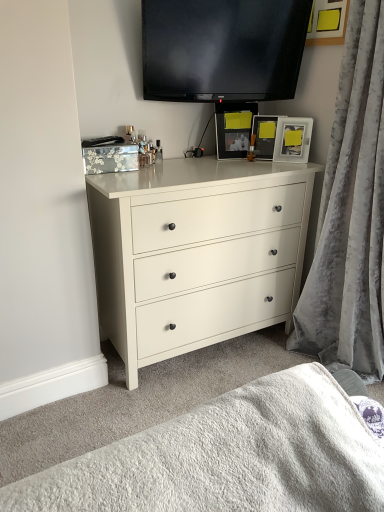
Where is `vacant space situated on the left part of matte black picture frame at center, placed as the first picture frame when sorted from left to right`? vacant space situated on the left part of matte black picture frame at center, placed as the first picture frame when sorted from left to right is located at coordinates (229, 160).